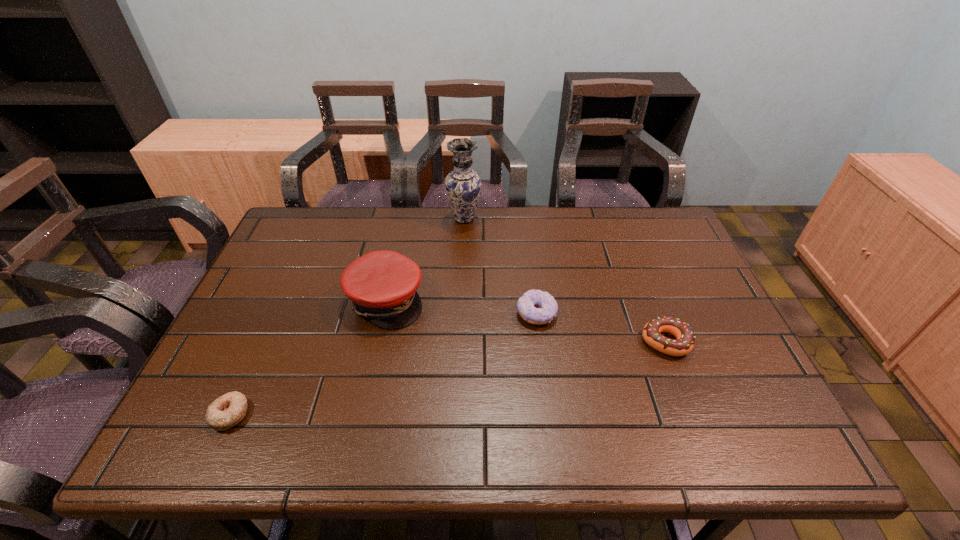
You are a GUI agent. You are given a task and a screenshot of the screen. Output one action in this format:
    pyautogui.click(x=<x>, y=<y>)
    Task: Click on the free region that satisfies the following two spatial constraints: 1. on the back side of the nearest doughnut; 2. on the left side of the tallest object
    This screenshot has width=960, height=540.
    Given the screenshot: What is the action you would take?
    pyautogui.click(x=319, y=219)

Find the location of a particular element. The image size is (960, 540). blank space that satisfies the following two spatial constraints: 1. on the front-facing side of the cap; 2. on the left side of the fourth object from left to right is located at coordinates (383, 313).

Where is `vacant space that satisfies the following two spatial constraints: 1. on the front-facing side of the rightmost object; 2. on the left side of the cap`? This screenshot has width=960, height=540. vacant space that satisfies the following two spatial constraints: 1. on the front-facing side of the rightmost object; 2. on the left side of the cap is located at coordinates (376, 342).

Find the location of a particular element. vacant space that satisfies the following two spatial constraints: 1. on the front-facing side of the cap; 2. on the right side of the rightmost doughnut is located at coordinates (376, 342).

Identify the location of vacant space that satisfies the following two spatial constraints: 1. on the front side of the third object from left to right; 2. on the right side of the fourth object from left to right. [x=460, y=313].